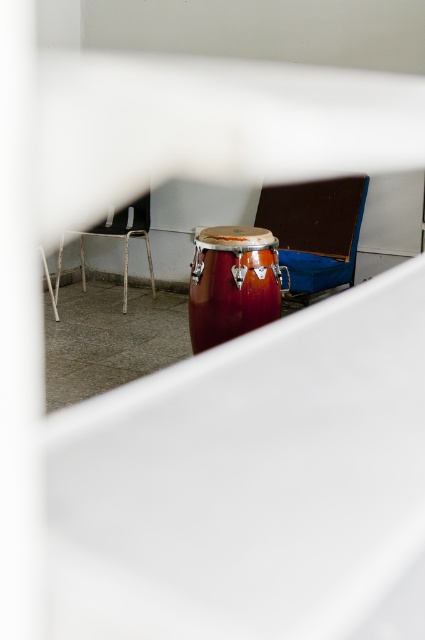
Is wooden chair at center thinner than metallic silver chair at upper left?

Yes, wooden chair at center is thinner than metallic silver chair at upper left.

How distant is wooden chair at center from metallic silver chair at upper left?

The distance of wooden chair at center from metallic silver chair at upper left is 89.07 centimeters.

This screenshot has height=640, width=425. Find the location of `wooden chair at center`. wooden chair at center is located at coordinates (314, 228).

Is point (210, 332) more distant than point (81, 266)?

No, it is in front of (81, 266).

Identify the location of shiny brown drum at center. pos(232,284).

Does shiny brown drum at center appear on the right side of wooden chair at center?

No, shiny brown drum at center is not to the right of wooden chair at center.

Is point (206, 241) closer to camera compared to point (282, 262)?

That is True.

In order to click on shiny brown drum at center in this screenshot , I will do `click(232, 284)`.